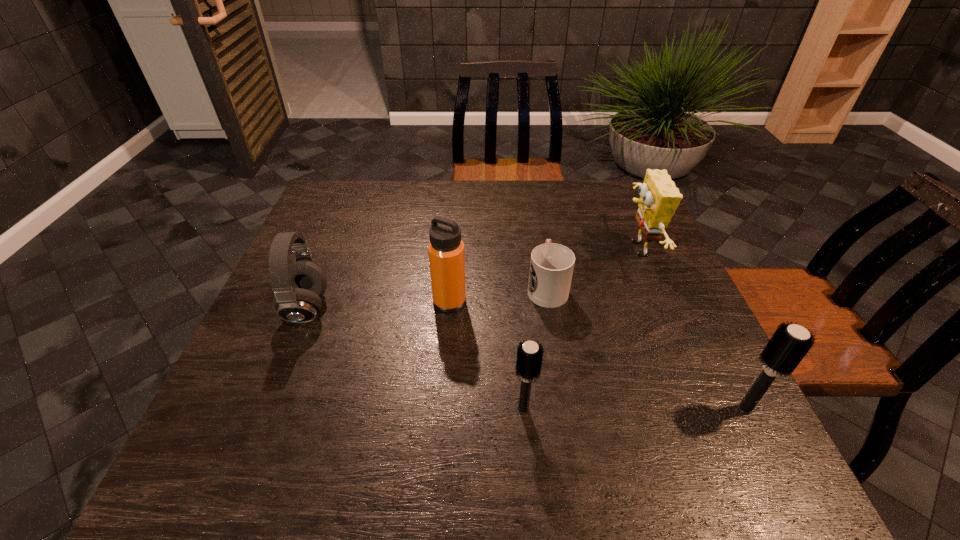
Identify which object is the third nearest to the thermos bottle. Please provide its 2D coordinates. Your answer should be formatted as a tuple, i.e. [(x, y)], where the tuple contains the x and y coordinates of a point satisfying the conditions above.

[(529, 355)]

In order to click on free location that satisfies the following two spatial constraints: 1. on the face of the taller hairbrush; 2. on the left side of the second object from right to left in this screenshot , I will do `click(704, 409)`.

Locate an element on the screen. The height and width of the screenshot is (540, 960). free space in the image that satisfies the following two spatial constraints: 1. on the ear cups of the leftmost object; 2. on the left side of the third object from left to right is located at coordinates (266, 409).